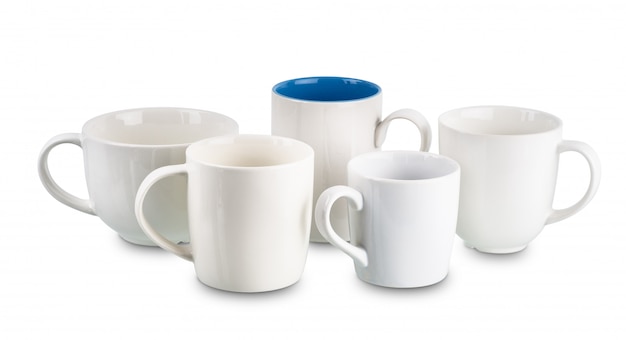
Identify the location of base of mug. (146, 246), (249, 296), (317, 242), (404, 289), (500, 253).